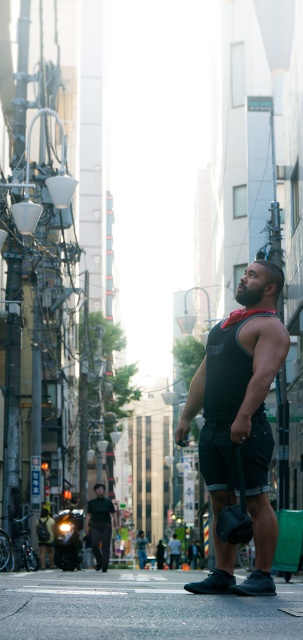
Is black matte tank top at center bigger than dark green shirt at lower center?

Incorrect, black matte tank top at center is not larger than dark green shirt at lower center.

Measure the distance between black matte tank top at center and dark green shirt at lower center.

19.69 meters

Between point (259, 593) and point (107, 561), which one is positioned behind?

The point (107, 561) is more distant.

Identify the location of black matte tank top at center. (239, 428).